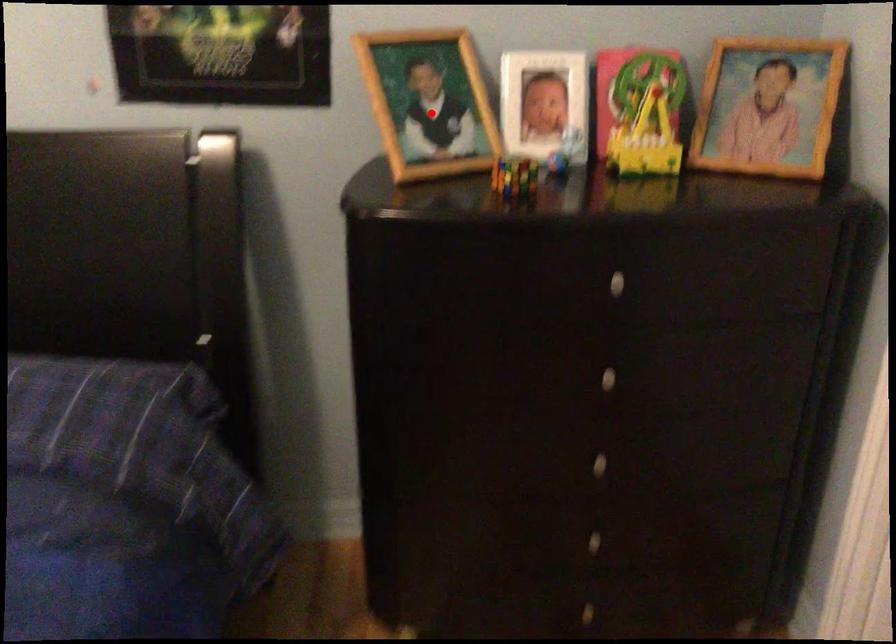
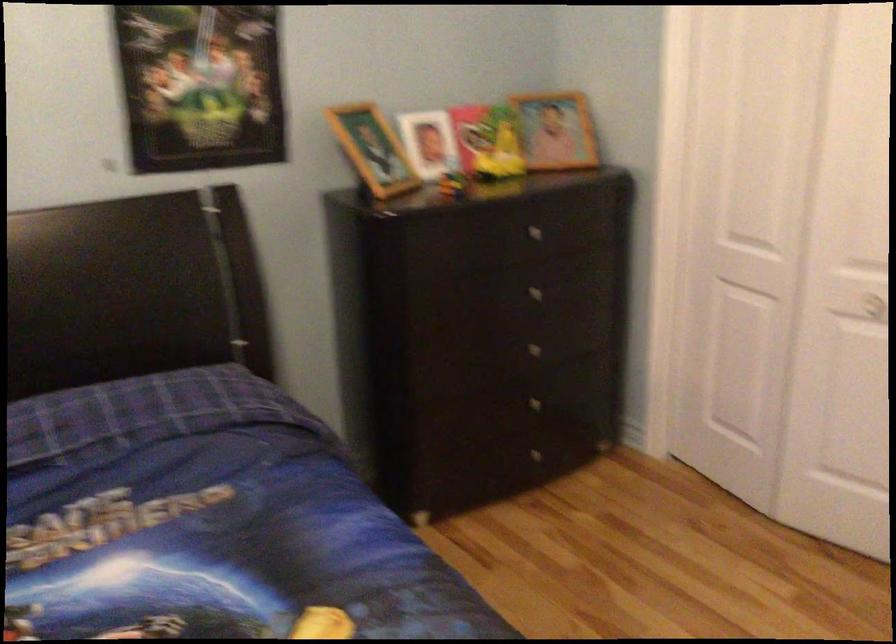
Question: A red point is marked in image1. In image2, is the corresponding 3D point closer to the camera or farther? Reply with the corresponding letter.

Choices:
 (A) The corresponding 3D point is closer.
 (B) The corresponding 3D point is farther.

Answer: (B)